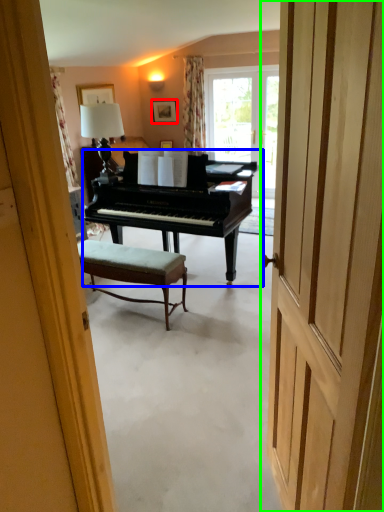
Question: Which object is the farthest from picture frame (highlighted by a red box)? Choose among these: piano (highlighted by a blue box) or door (highlighted by a green box).

Choices:
 (A) piano
 (B) door

Answer: (B)